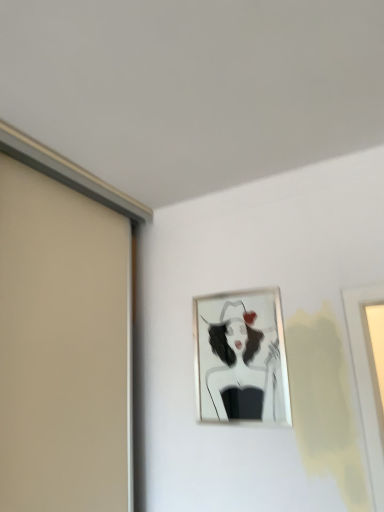
What do you see at coordinates (241, 358) in the screenshot?
I see `silver metallic picture frame at center` at bounding box center [241, 358].

Where is `silver metallic picture frame at center`? The height and width of the screenshot is (512, 384). silver metallic picture frame at center is located at coordinates (241, 358).

Image resolution: width=384 pixels, height=512 pixels. Identify the location of silver metallic picture frame at center. (241, 358).